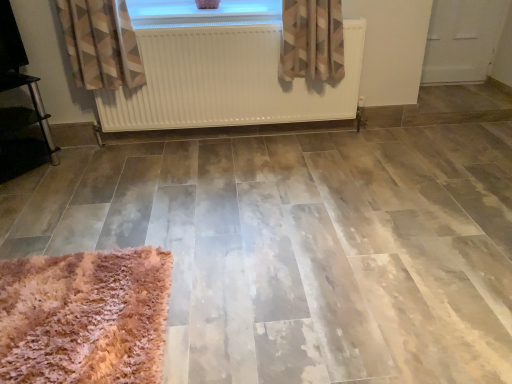
Question: Does transparent glass window at upper center have a greater height compared to fuzzy pink rug at lower left?

Choices:
 (A) yes
 (B) no

Answer: (B)

Question: Is transparent glass window at upper center positioned far away from fuzzy pink rug at lower left?

Choices:
 (A) yes
 (B) no

Answer: (A)

Question: From a real-world perspective, is transparent glass window at upper center on fuzzy pink rug at lower left?

Choices:
 (A) no
 (B) yes

Answer: (B)

Question: Is the position of transparent glass window at upper center less distant than that of fuzzy pink rug at lower left?

Choices:
 (A) yes
 (B) no

Answer: (B)

Question: Considering the relative sizes of transparent glass window at upper center and fuzzy pink rug at lower left in the image provided, is transparent glass window at upper center smaller than fuzzy pink rug at lower left?

Choices:
 (A) yes
 (B) no

Answer: (A)

Question: Considering the positions of fuzzy pink rug at lower left and white matte radiator at upper center in the image, is fuzzy pink rug at lower left wider or thinner than white matte radiator at upper center?

Choices:
 (A) thin
 (B) wide

Answer: (B)

Question: Looking at the image, does fuzzy pink rug at lower left seem bigger or smaller compared to white matte radiator at upper center?

Choices:
 (A) small
 (B) big

Answer: (A)

Question: From the image's perspective, is fuzzy pink rug at lower left positioned above or below white matte radiator at upper center?

Choices:
 (A) below
 (B) above

Answer: (A)

Question: Would you say fuzzy pink rug at lower left is to the left or to the right of white matte radiator at upper center in the picture?

Choices:
 (A) right
 (B) left

Answer: (B)

Question: Considering the relative positions of white matte radiator at upper center and fuzzy pink rug at lower left in the image provided, is white matte radiator at upper center to the left or to the right of fuzzy pink rug at lower left?

Choices:
 (A) right
 (B) left

Answer: (A)

Question: Considering the positions of white matte radiator at upper center and fuzzy pink rug at lower left in the image, is white matte radiator at upper center wider or thinner than fuzzy pink rug at lower left?

Choices:
 (A) thin
 (B) wide

Answer: (A)

Question: Do you think white matte radiator at upper center is within fuzzy pink rug at lower left, or outside of it?

Choices:
 (A) outside
 (B) inside

Answer: (A)

Question: Is white matte radiator at upper center taller or shorter than fuzzy pink rug at lower left?

Choices:
 (A) tall
 (B) short

Answer: (A)

Question: Is transparent glass window at upper center inside or outside of fuzzy pink rug at lower left?

Choices:
 (A) inside
 (B) outside

Answer: (B)

Question: Considering their positions, is transparent glass window at upper center located in front of or behind fuzzy pink rug at lower left?

Choices:
 (A) behind
 (B) front

Answer: (A)